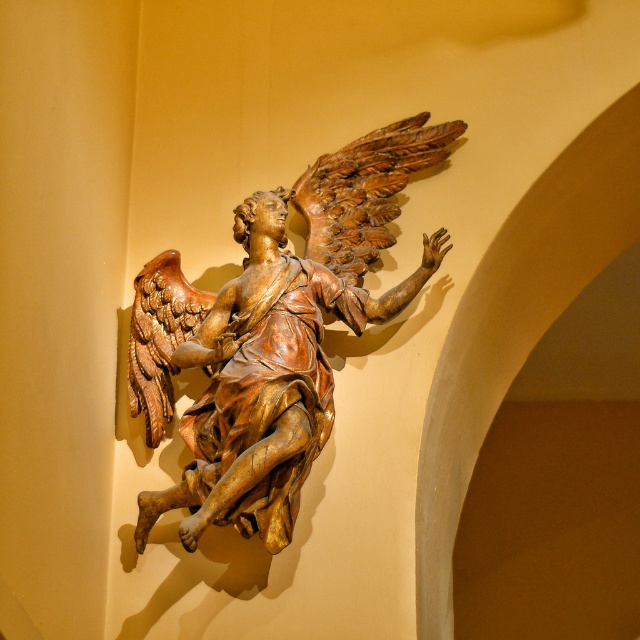
Question: Which of the following is the farthest from the observer?

Choices:
 (A) golden polished wood wing at upper center
 (B) gold polished wood angel at center

Answer: (A)

Question: Is gold polished wood angel at center thinner than golden polished wood wing at upper center?

Choices:
 (A) yes
 (B) no

Answer: (B)

Question: Can you confirm if gold polished wood angel at center is smaller than golden polished wood wing at upper center?

Choices:
 (A) yes
 (B) no

Answer: (B)

Question: Observing the image, what is the correct spatial positioning of gold polished wood angel at center in reference to golden polished wood wing at upper center?

Choices:
 (A) right
 (B) left

Answer: (B)